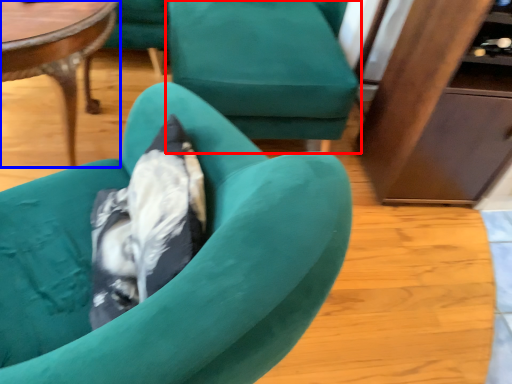
Question: Which of the following is the farthest to the observer, chair (highlighted by a red box) or coffee table (highlighted by a blue box)?

Choices:
 (A) chair
 (B) coffee table

Answer: (A)